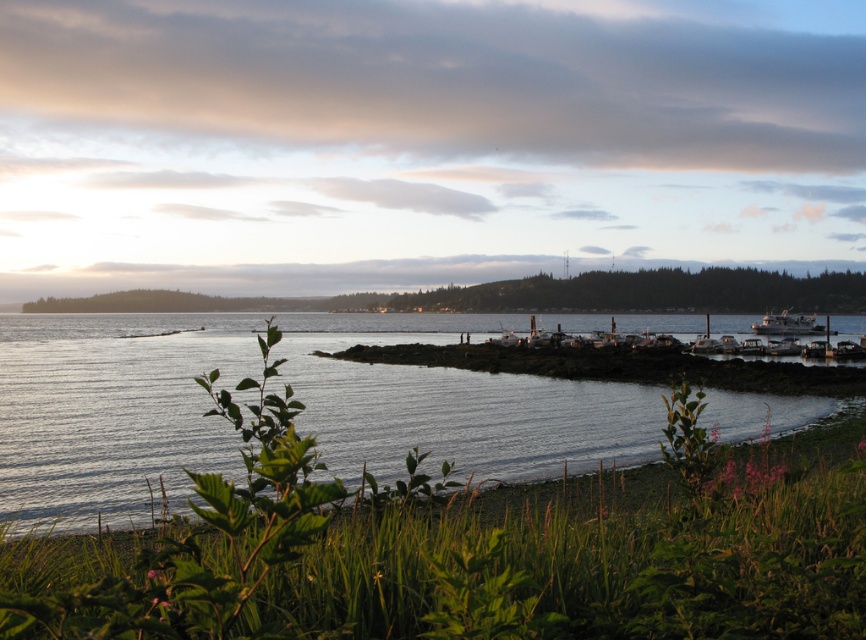
Is clear water at lower center to the left of white matte boat at right from the viewer's perspective?

Correct, you'll find clear water at lower center to the left of white matte boat at right.

Identify the location of clear water at lower center. (113, 410).